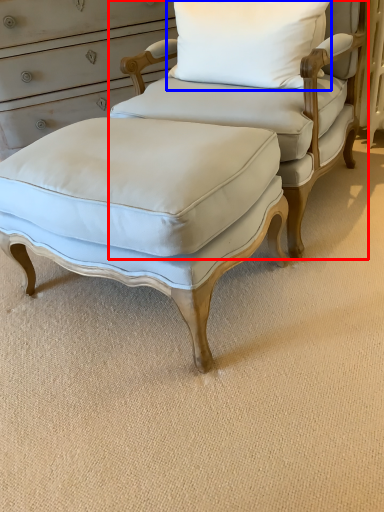
Question: Which object is further to the camera taking this photo, chair (highlighted by a red box) or pillow (highlighted by a blue box)?

Choices:
 (A) chair
 (B) pillow

Answer: (B)